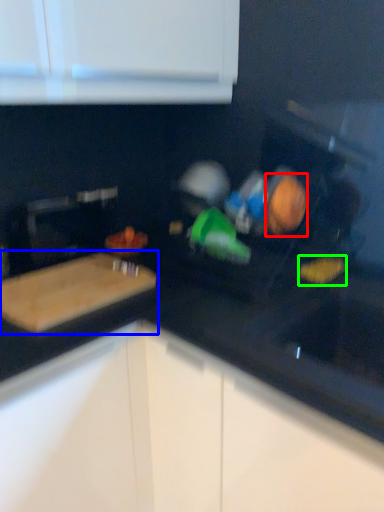
Question: Considering the real-world distances, which object is farthest from food (highlighted by a red box)? cutting board (highlighted by a blue box) or food (highlighted by a green box)?

Choices:
 (A) cutting board
 (B) food

Answer: (A)